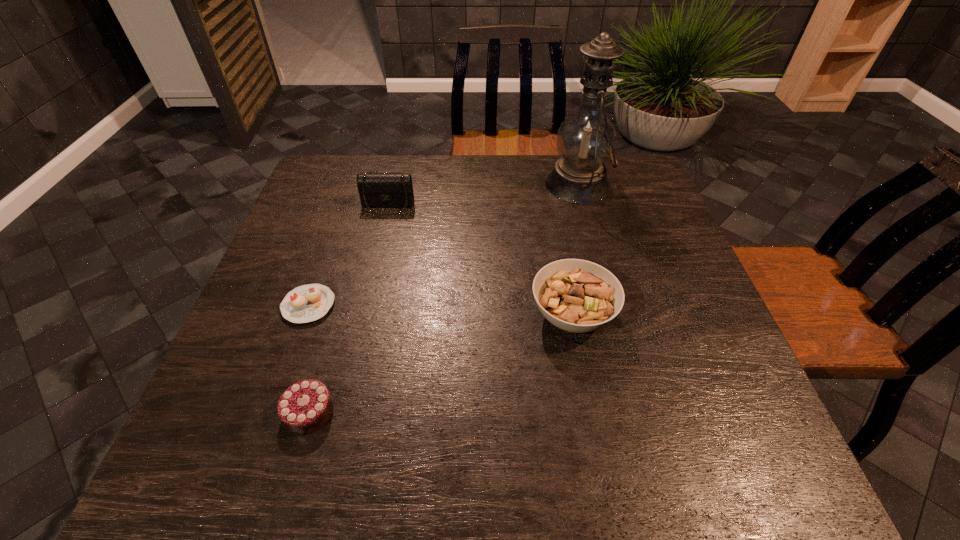
Image resolution: width=960 pixels, height=540 pixels. Find the location of `the tallest object`. the tallest object is located at coordinates pos(586,139).

Find the location of a particular element. The image size is (960, 540). clutch bag is located at coordinates (377, 190).

Find the location of a particular element. This screenshot has height=540, width=960. stew is located at coordinates (575, 295).

You are a GUI agent. You are given a task and a screenshot of the screen. Output one action in this format:
    pyautogui.click(x=<x>, y=<y>)
    Task: Click on the nearest object
    The image size is (960, 540).
    Given the screenshot: What is the action you would take?
    pyautogui.click(x=306, y=406)

At what (x,y) coordinates should I click in order to perform the action: click on chocolate cake. Please return your answer as a coordinate pair (x, y). The image size is (960, 540). Looking at the image, I should click on (306, 406).

Locate an element on the screen. the shortest object is located at coordinates (306, 303).

You are a GUI agent. You are given a task and a screenshot of the screen. Output one action in this format:
    pyautogui.click(x=<x>, y=<y>)
    Task: Click on the vacant space located on the left of the tallest object
    The image size is (960, 540).
    Given the screenshot: What is the action you would take?
    pyautogui.click(x=452, y=184)

Where is `free point located 0.300m on the front flap of the clutch bag`? The image size is (960, 540). free point located 0.300m on the front flap of the clutch bag is located at coordinates point(366,296).

Identify the location of free region located 0.380m on the left of the stew. (357, 315).

Where is `free space located 0.160m on the right of the fourth tallest object`? This screenshot has width=960, height=540. free space located 0.160m on the right of the fourth tallest object is located at coordinates (420, 411).